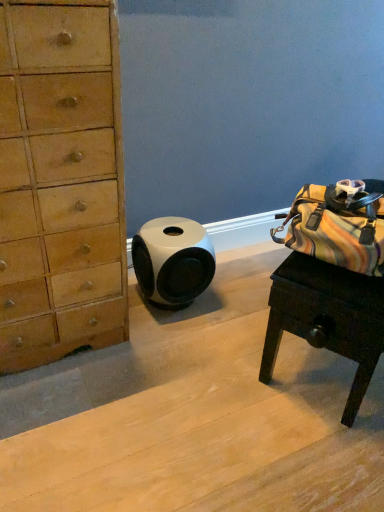
Question: Are wooden desk at right and white glossy speaker at center located far from each other?

Choices:
 (A) yes
 (B) no

Answer: (B)

Question: Can you confirm if wooden desk at right is bigger than white glossy speaker at center?

Choices:
 (A) no
 (B) yes

Answer: (B)

Question: From the image's perspective, is wooden desk at right below white glossy speaker at center?

Choices:
 (A) no
 (B) yes

Answer: (B)

Question: Is wooden desk at right positioned with its back to white glossy speaker at center?

Choices:
 (A) yes
 (B) no

Answer: (A)

Question: Is wooden desk at right with white glossy speaker at center?

Choices:
 (A) no
 (B) yes

Answer: (A)

Question: Is white glossy speaker at center inside wooden desk at right?

Choices:
 (A) no
 (B) yes

Answer: (A)

Question: Is wooden desk at right at the back of white glossy speaker at center?

Choices:
 (A) no
 (B) yes

Answer: (A)

Question: Can you confirm if white glossy speaker at center is positioned to the left of wooden desk at right?

Choices:
 (A) no
 (B) yes

Answer: (B)

Question: Considering the relative positions of white glossy speaker at center and wooden desk at right in the image provided, is white glossy speaker at center to the right of wooden desk at right from the viewer's perspective?

Choices:
 (A) no
 (B) yes

Answer: (A)

Question: Can you confirm if white glossy speaker at center is taller than wooden desk at right?

Choices:
 (A) yes
 (B) no

Answer: (B)

Question: From the image's perspective, is white glossy speaker at center located above wooden desk at right?

Choices:
 (A) yes
 (B) no

Answer: (A)

Question: Is white glossy speaker at center smaller than wooden desk at right?

Choices:
 (A) yes
 (B) no

Answer: (A)

Question: In terms of size, does white glossy speaker at center appear bigger or smaller than wooden desk at right?

Choices:
 (A) big
 (B) small

Answer: (B)